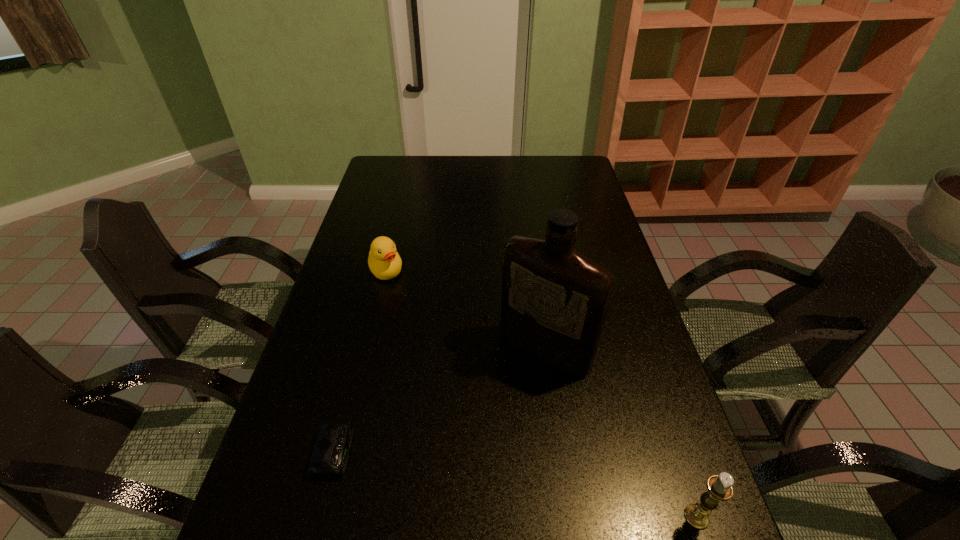
Locate an element on the screen. Image resolution: width=960 pixels, height=540 pixels. free spot between the candle holder and the duck is located at coordinates (541, 393).

At what (x,y) coordinates should I click in order to perform the action: click on free space between the liquor and the nearest object. Please return your answer as a coordinate pair (x, y). Looking at the image, I should click on (620, 434).

Where is `free space between the third farthest object and the duck`? The image size is (960, 540). free space between the third farthest object and the duck is located at coordinates (360, 361).

Locate an element on the screen. The width and height of the screenshot is (960, 540). empty location between the candle holder and the third tallest object is located at coordinates (541, 393).

This screenshot has height=540, width=960. Identify the location of free spot between the third farthest object and the second shortest object. (360, 361).

This screenshot has height=540, width=960. I want to click on vacant region between the third farthest object and the farthest object, so click(x=360, y=361).

Locate an element on the screen. free space between the third nearest object and the shortest object is located at coordinates (439, 401).

At what (x,y) coordinates should I click in order to perform the action: click on object that stands as the third closest to the shortest object. Please return your answer as a coordinate pair (x, y). The width and height of the screenshot is (960, 540). Looking at the image, I should click on (719, 487).

Locate an element on the screen. object that can be found as the second closest to the third nearest object is located at coordinates (384, 261).

Locate an element on the screen. vacant point that satisfies the following two spatial constraints: 1. on the front side of the nearest object; 2. on the right side of the third tallest object is located at coordinates pos(326,517).